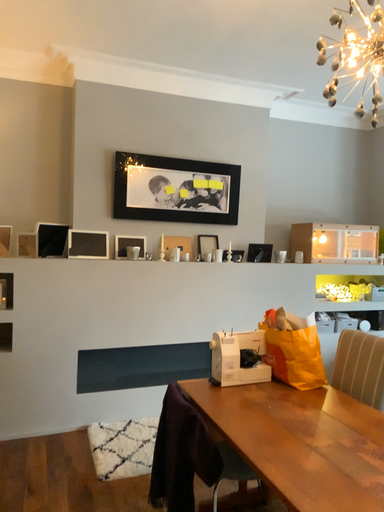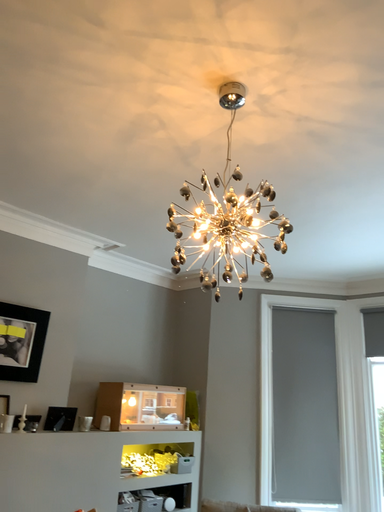
Question: How did the camera likely rotate when shooting the video?

Choices:
 (A) rotated upward
 (B) rotated downward

Answer: (A)